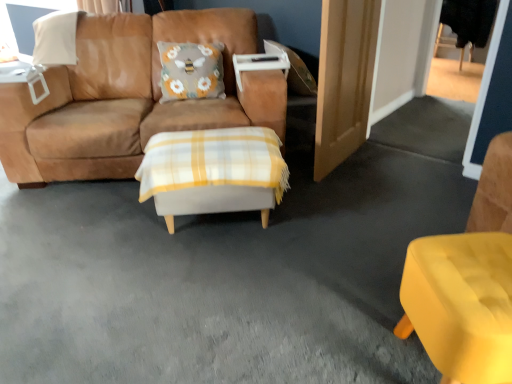
Identify the location of vacant region below wooden door at right (from a real-world perspective). (345, 168).